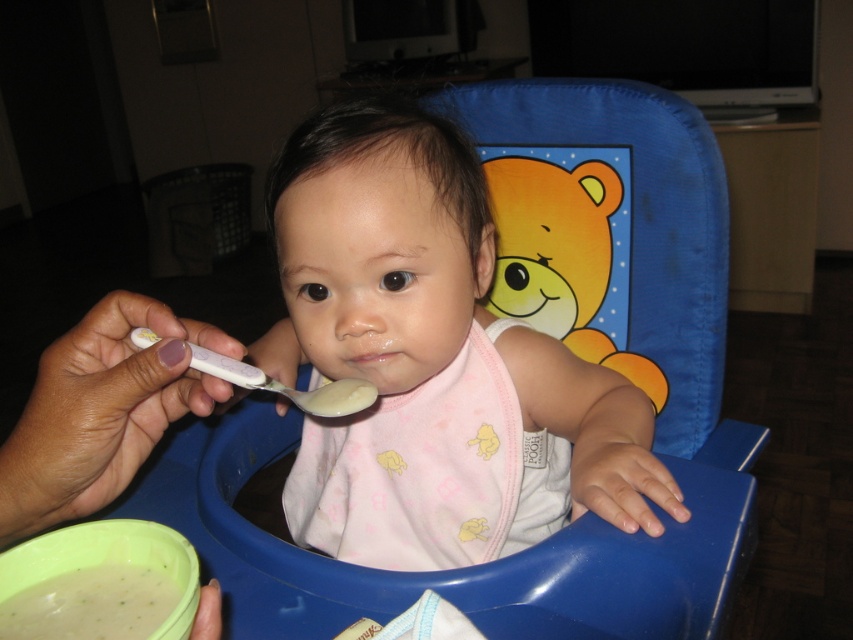
You are a parent feeding your baby in the kitchen. You notice two points on the high chair. Which point is closer to you, point (399, 563) or point (221, 365)?

Point (221, 365) is closer to you because it is less further than point (399, 563).

The baby is sitting in a blue high chair with a cartoon bear design on the backrest. They are wearing a light pink sleeveless bib at center. A hand holding a white spoon with a purple handle is near them. How far apart are the pink fabric bib at center and the spoon?

The pink fabric bib at center and the spoon are 18.42 inches apart.